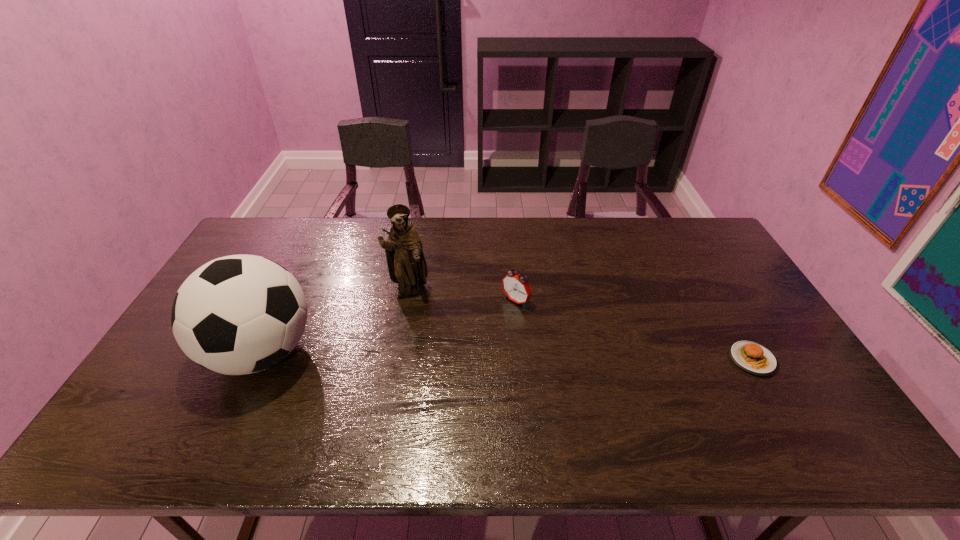
Locate an element on the screen. free spot at the right edge of the desktop is located at coordinates (718, 316).

You are a GUI agent. You are given a task and a screenshot of the screen. Output one action in this format:
    pyautogui.click(x=<x>, y=<y>)
    Task: Click on the free point at the far left corner
    
    Given the screenshot: What is the action you would take?
    pyautogui.click(x=246, y=241)

At what (x,y) coordinates should I click in order to perform the action: click on vacant region at the near left corner of the desktop. Please return your answer as a coordinate pair (x, y). Image resolution: width=960 pixels, height=540 pixels. Looking at the image, I should click on (197, 404).

Find the location of a particular element. vacant region at the near right corner of the desktop is located at coordinates (815, 399).

This screenshot has height=540, width=960. Identify the location of free space between the third object from left to right and the second object from left to right. (462, 296).

Where is `free space between the third object from right to left and the rightmost object`? The width and height of the screenshot is (960, 540). free space between the third object from right to left and the rightmost object is located at coordinates (581, 325).

At what (x,y) coordinates should I click in order to perform the action: click on free space between the figurine and the leftmost object. Please return your answer as a coordinate pair (x, y). The image size is (960, 540). Looking at the image, I should click on (335, 321).

Identify the location of vacant space in between the leftmost object and the third object from right to left. This screenshot has width=960, height=540. (335, 321).

In order to click on vacant area between the second object from left to right and the alarm clock in this screenshot , I will do `click(462, 296)`.

This screenshot has height=540, width=960. I want to click on free space between the rightmost object and the second object from left to right, so click(581, 325).